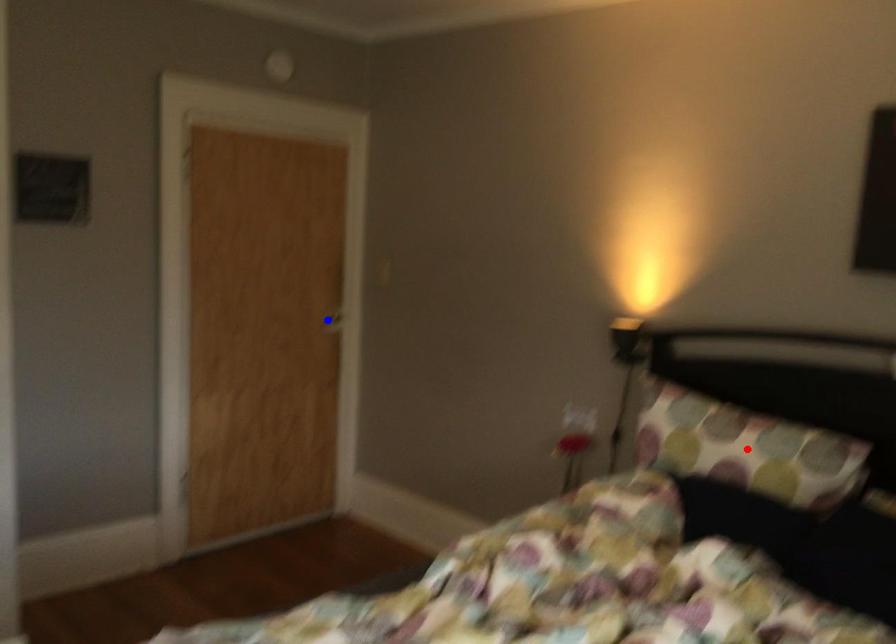
Question: Which of the two points in the image is closer to the camera?

Choices:
 (A) Blue point is closer.
 (B) Red point is closer.

Answer: (B)